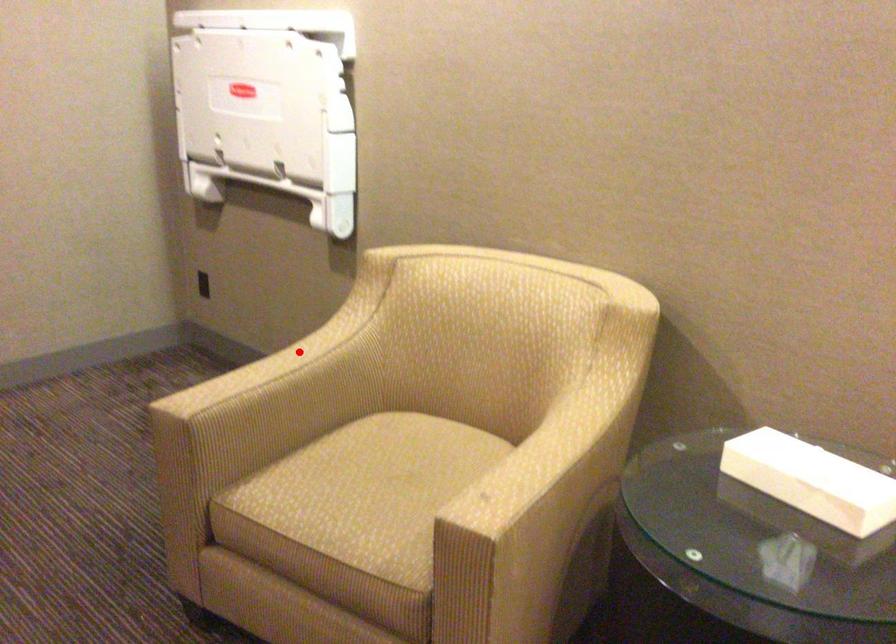
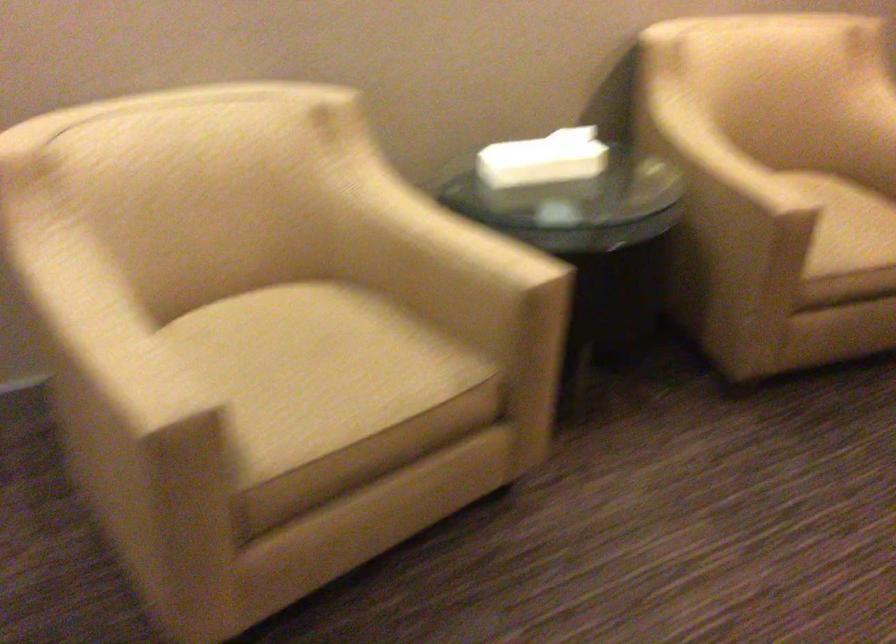
Question: A red point is marked in image1. In image2, is the corresponding 3D point closer to the camera or farther? Reply with the corresponding letter.

Choices:
 (A) The corresponding 3D point is closer.
 (B) The corresponding 3D point is farther.

Answer: (A)